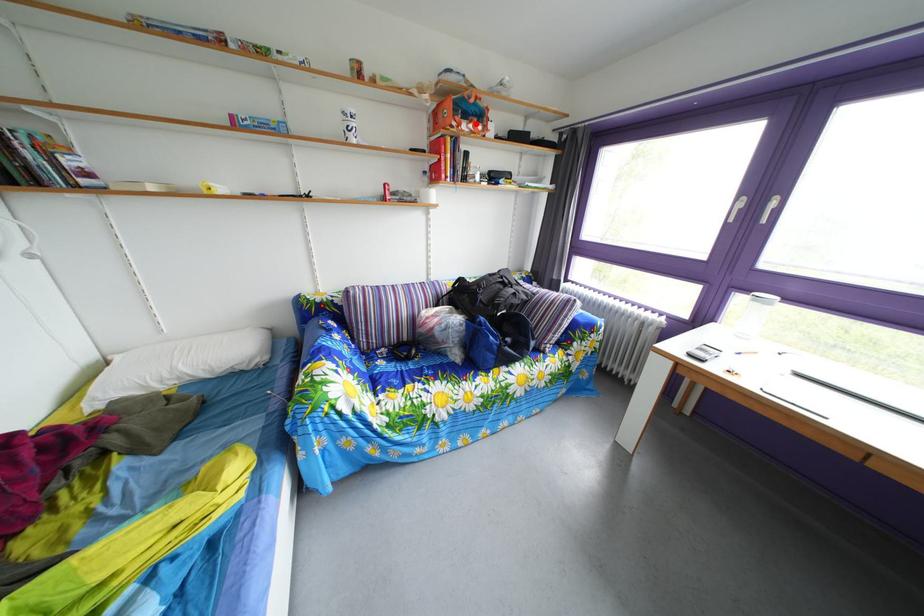
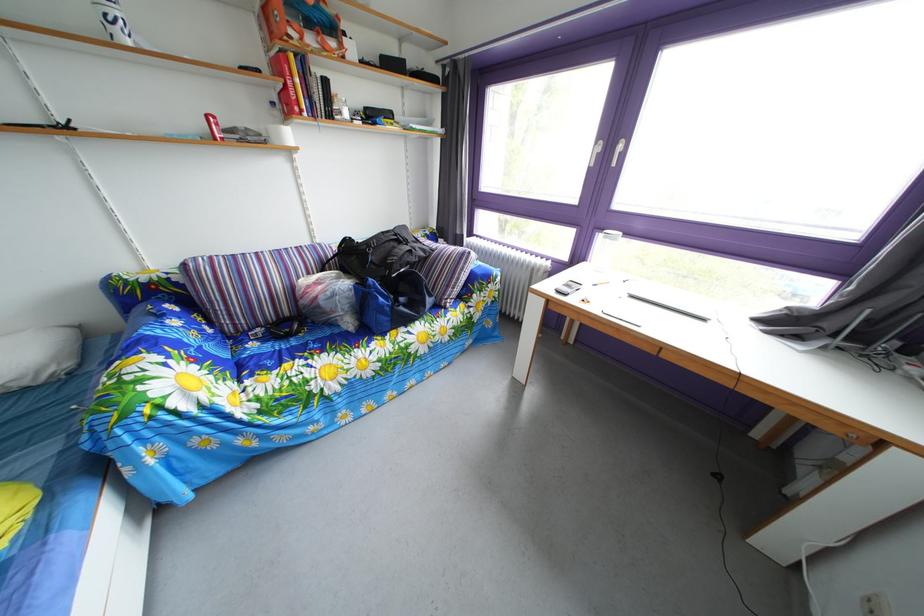
Question: I am providing you with two images of the same scene from different viewpoints. In image1, a red point is highlighted. Considering the same 3D point in image2, which of the following is correct?

Choices:
 (A) It is closer
 (B) It is farther

Answer: (B)